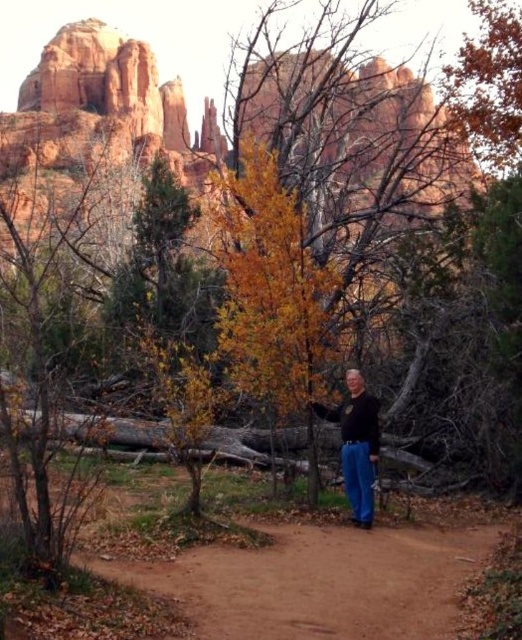
Question: Is brown dirt path at center to the right of black matte shirt at center from the viewer's perspective?

Choices:
 (A) yes
 (B) no

Answer: (B)

Question: Which of the following is the farthest from the observer?

Choices:
 (A) brown dirt path at center
 (B) black matte shirt at center

Answer: (B)

Question: Which of the following is the closest to the observer?

Choices:
 (A) black matte shirt at center
 (B) brown dirt path at center

Answer: (B)

Question: Is brown dirt path at center below black matte shirt at center?

Choices:
 (A) yes
 (B) no

Answer: (A)

Question: Which point is farther to the camera?

Choices:
 (A) (353, 508)
 (B) (455, 524)

Answer: (B)

Question: Is brown dirt path at center closer to camera compared to black matte shirt at center?

Choices:
 (A) yes
 (B) no

Answer: (A)